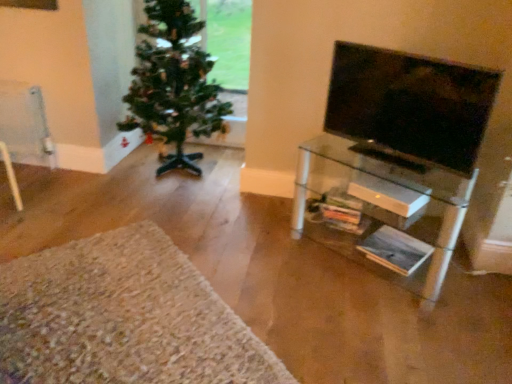
Locate an element on the screen. This screenshot has width=512, height=384. vacant space that is in between green matte christmas tree at left and white shaggy rug at lower left is located at coordinates (172, 228).